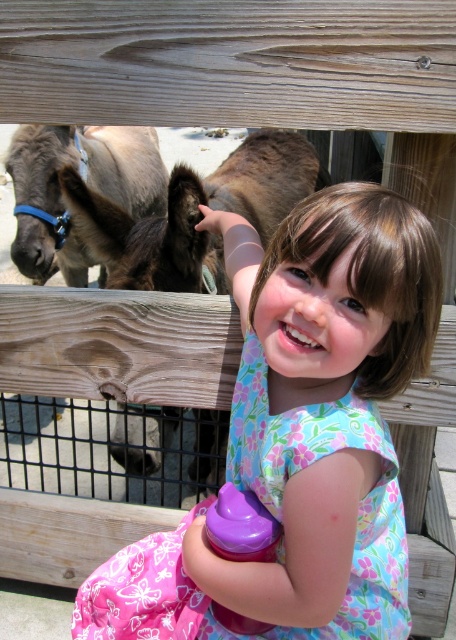
You are a photographer trying to capture the girl in the floral fabric dress at center and the brown fuzzy donkey at left in the same frame. Based on their positions, which subject is closer to the left edge of the photo?

The floral fabric dress at center is to the left of the brown fuzzy donkey at left, so the floral fabric dress at center is closer to the left edge of the photo.

You are a parent trying to decide which donkey your child can safely approach. The brown fuzzy donkey at left is closer to the railing and the child. The brown fuzzy donkey at upper left is farther away. Considering their widths, which donkey might require more caution due to its size?

The brown fuzzy donkey at left might be wider than brown fuzzy donkey at upper left, so it could require more caution due to its larger size.

From the picture: You are a photographer trying to capture the young girl in the floral fabric dress at center. Based on the coordinates provided, where should you position your camera to ensure the dress is centered in the frame?

The floral fabric dress at center is located at point coordinates (300, 433), so you should position your camera to center the frame at those coordinates to capture the dress in the center.